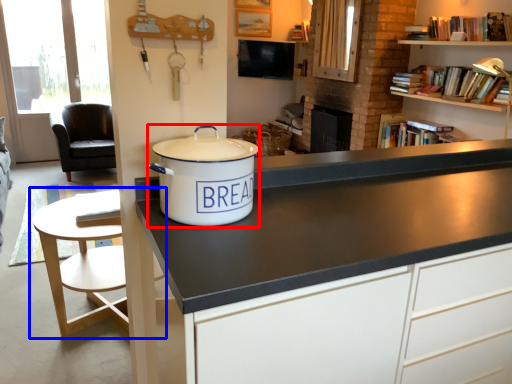
Question: Which object is further to the camera taking this photo, cooker (highlighted by a red box) or table (highlighted by a blue box)?

Choices:
 (A) cooker
 (B) table

Answer: (B)